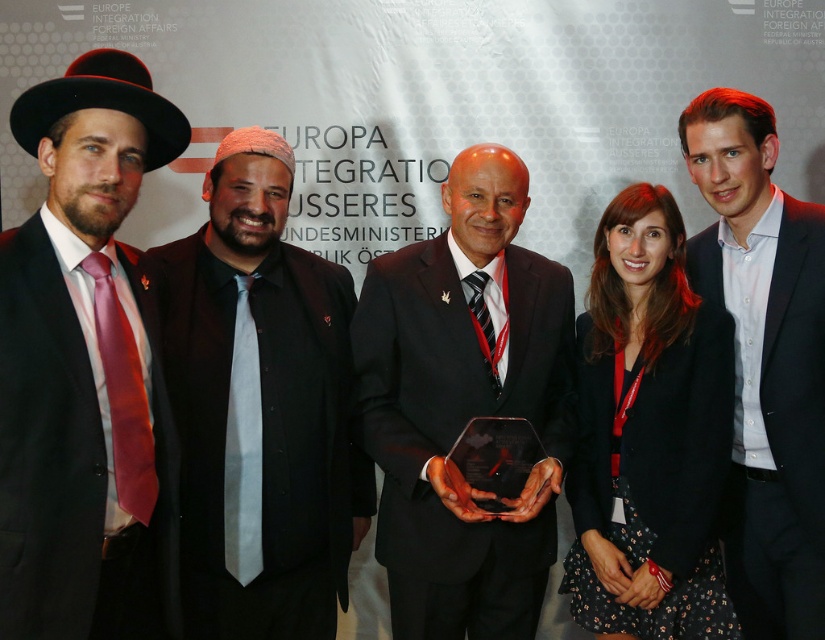
Question: Is gray fabric hat at left closer to the viewer compared to black textured blazer at center?

Choices:
 (A) no
 (B) yes

Answer: (B)

Question: Which of the following is the farthest from the observer?

Choices:
 (A) [x=213, y=464]
 (B) [x=599, y=547]
 (C) [x=6, y=346]
 (D) [x=814, y=476]

Answer: (B)

Question: Is matte black suit at left to the left of black glossy award at center from the viewer's perspective?

Choices:
 (A) no
 (B) yes

Answer: (B)

Question: Which object is the farthest from the black glossy award at center?

Choices:
 (A) black textured blazer at center
 (B) matte black suit at left
 (C) white shirt at center
 (D) gray fabric hat at left

Answer: (B)

Question: Which is farther from the gray fabric hat at left?

Choices:
 (A) matte black suit at left
 (B) black glossy award at center

Answer: (B)

Question: Can you confirm if matte black suit at left is positioned to the right of black glossy award at center?

Choices:
 (A) no
 (B) yes

Answer: (A)